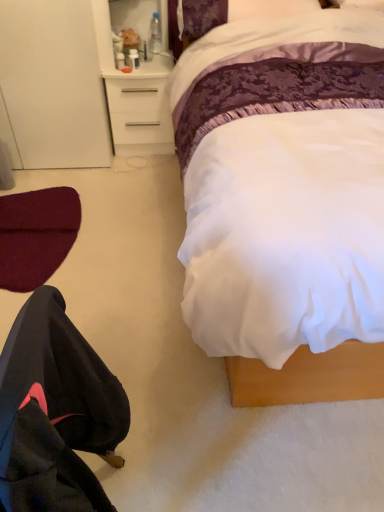
Question: Does point (52, 367) appear closer or farther from the camera than point (142, 97)?

Choices:
 (A) closer
 (B) farther

Answer: (A)

Question: Is black fabric robe at lower left situated inside white plastic desk at upper center or outside?

Choices:
 (A) inside
 (B) outside

Answer: (B)

Question: Which is farther from the maroon fabric swivel chair at lower left?

Choices:
 (A) clear plastic bottle at upper center
 (B) white plastic desk at upper center
 (C) black fabric robe at lower left
 (D) white satin bed at center

Answer: (C)

Question: Estimate the real-world distances between objects in this image. Which object is farther from the white plastic desk at upper center?

Choices:
 (A) clear plastic bottle at upper center
 (B) maroon fabric swivel chair at lower left
 (C) white satin bed at center
 (D) black fabric robe at lower left

Answer: (D)